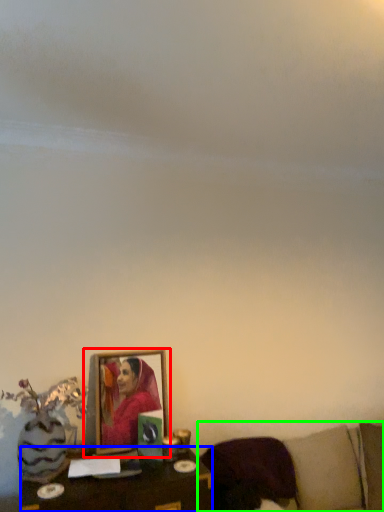
Question: Which object is the farthest from picture frame (highlighted by a red box)? Choose among these: table (highlighted by a blue box) or furniture (highlighted by a green box).

Choices:
 (A) table
 (B) furniture

Answer: (B)